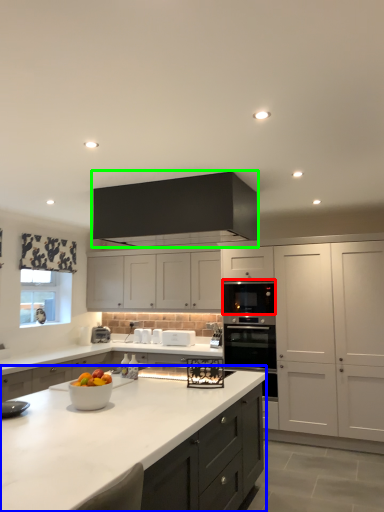
Question: Which object is positioned farthest from oven (highlighted by a red box)? Select from countertop (highlighted by a blue box) and cabinetry (highlighted by a green box).

Choices:
 (A) countertop
 (B) cabinetry

Answer: (A)